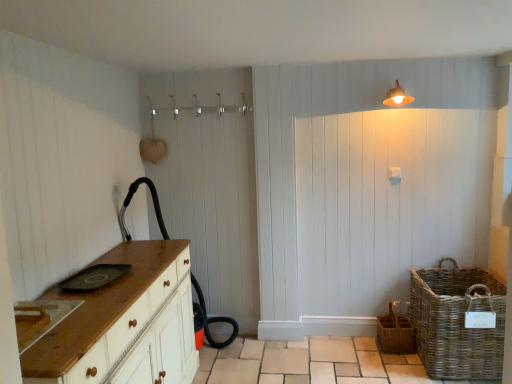
Question: Is wooden chest of drawers at left next to woven brown basket at lower right, the 2th basket when ordered from left to right?

Choices:
 (A) no
 (B) yes

Answer: (A)

Question: Does wooden chest of drawers at left have a lesser width compared to woven brown basket at lower right, the 2th basket when ordered from left to right?

Choices:
 (A) yes
 (B) no

Answer: (A)

Question: Is wooden chest of drawers at left at the left side of woven brown basket at lower right, which is counted as the 1th basket, starting from the right?

Choices:
 (A) yes
 (B) no

Answer: (A)

Question: Is the position of wooden chest of drawers at left more distant than that of woven brown basket at lower right, the 2th basket when ordered from left to right?

Choices:
 (A) no
 (B) yes

Answer: (A)

Question: Would you say woven brown basket at lower right, the 2th basket when ordered from left to right, is part of wooden chest of drawers at left's contents?

Choices:
 (A) yes
 (B) no

Answer: (B)

Question: Is woven brown basket at lower right, the 2th basket when ordered from left to right, inside the boundaries of matte white light fixture at upper right, or outside?

Choices:
 (A) inside
 (B) outside

Answer: (B)

Question: In the image, is woven brown basket at lower right, the 2th basket when ordered from left to right, positioned in front of or behind matte white light fixture at upper right?

Choices:
 (A) behind
 (B) front

Answer: (B)

Question: In terms of height, does woven brown basket at lower right, the 2th basket when ordered from left to right, look taller or shorter compared to matte white light fixture at upper right?

Choices:
 (A) tall
 (B) short

Answer: (A)

Question: In terms of size, does woven brown basket at lower right, which is counted as the 1th basket, starting from the right, appear bigger or smaller than matte white light fixture at upper right?

Choices:
 (A) small
 (B) big

Answer: (B)

Question: Is point (419, 306) closer or farther from the camera than point (409, 350)?

Choices:
 (A) closer
 (B) farther

Answer: (A)

Question: In terms of size, does woven brown basket at lower right, the 2th basket when ordered from left to right, appear bigger or smaller than woven wicker basket at lower right, acting as the 2th basket starting from the right?

Choices:
 (A) big
 (B) small

Answer: (A)

Question: Considering the relative positions of woven brown basket at lower right, the 2th basket when ordered from left to right, and woven wicker basket at lower right, acting as the 2th basket starting from the right, in the image provided, is woven brown basket at lower right, the 2th basket when ordered from left to right, to the left or to the right of woven wicker basket at lower right, acting as the 2th basket starting from the right,?

Choices:
 (A) right
 (B) left

Answer: (A)

Question: Considering the positions of woven brown basket at lower right, the 2th basket when ordered from left to right, and woven wicker basket at lower right, positioned as the 1th basket in left-to-right order, in the image, is woven brown basket at lower right, the 2th basket when ordered from left to right, taller or shorter than woven wicker basket at lower right, positioned as the 1th basket in left-to-right order,?

Choices:
 (A) short
 (B) tall

Answer: (B)

Question: Does point (403, 334) appear closer or farther from the camera than point (486, 364)?

Choices:
 (A) farther
 (B) closer

Answer: (A)

Question: From a real-world perspective, is woven wicker basket at lower right, acting as the 2th basket starting from the right, above or below woven brown basket at lower right, which is counted as the 1th basket, starting from the right?

Choices:
 (A) above
 (B) below

Answer: (B)